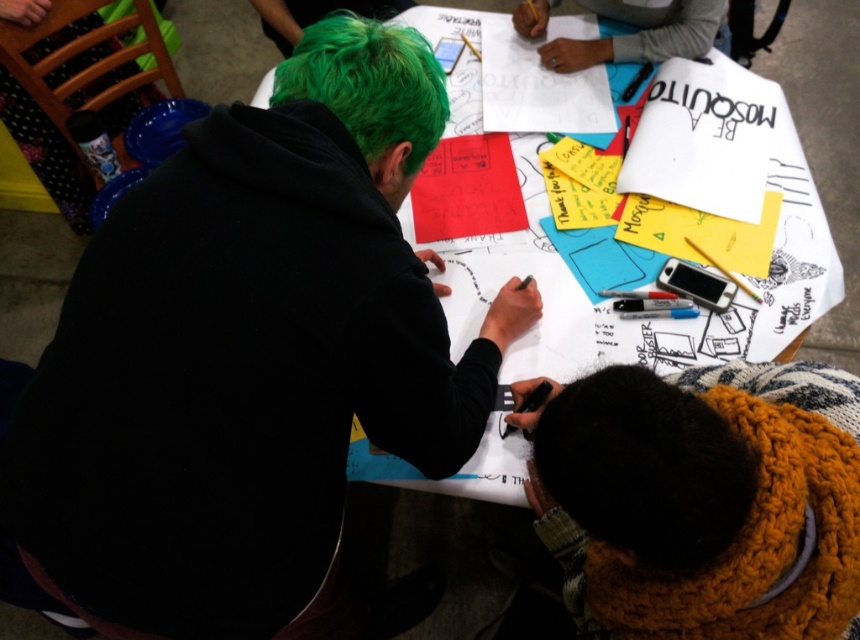
You are a photographer standing behind the table and want to take a photo of the white paper at center and the green matte hair at upper left. Which object will appear closer to the camera in the photo?

The white paper at center will appear closer to the camera in the photo because it is further to the viewer than the green matte hair at upper left, meaning it is positioned nearer to the photographer.

You are a photographer standing in front of the table. You need to capture a photo that includes both the black matte hoodie at upper left and the gray fabric at upper center. Based on their positions, which object should you position closer to the left side of your camera frame?

The black matte hoodie at upper left should be positioned closer to the left side of your camera frame since it is located to the left of the gray fabric at upper center.